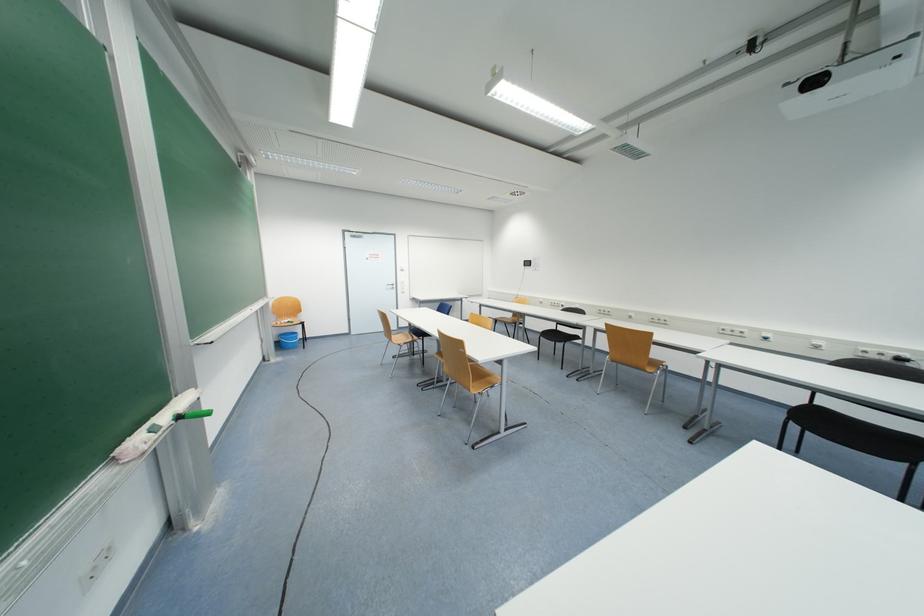
You are a GUI agent. You are given a task and a screenshot of the screen. Output one action in this format:
    pyautogui.click(x=<x>, y=<y>)
    Task: Click on the silver door handle
    The image size is (924, 616).
    Given the screenshot: What is the action you would take?
    pyautogui.click(x=390, y=285)